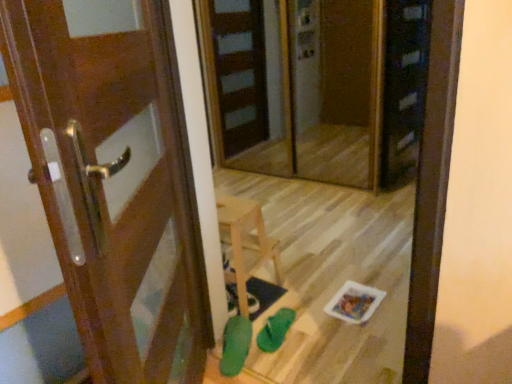
Locate an element on the screen. free space to the back side of transparent glass screen door at center is located at coordinates (297, 153).